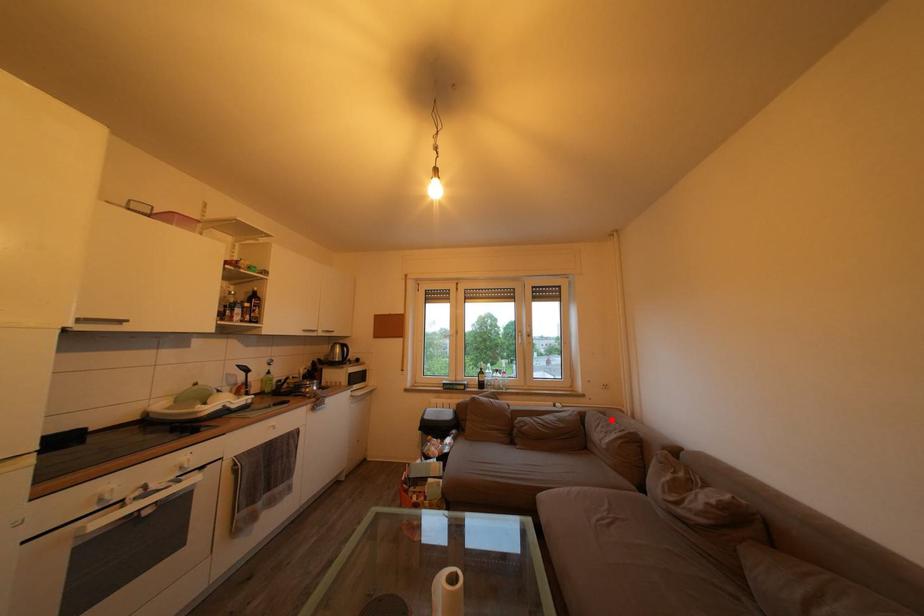
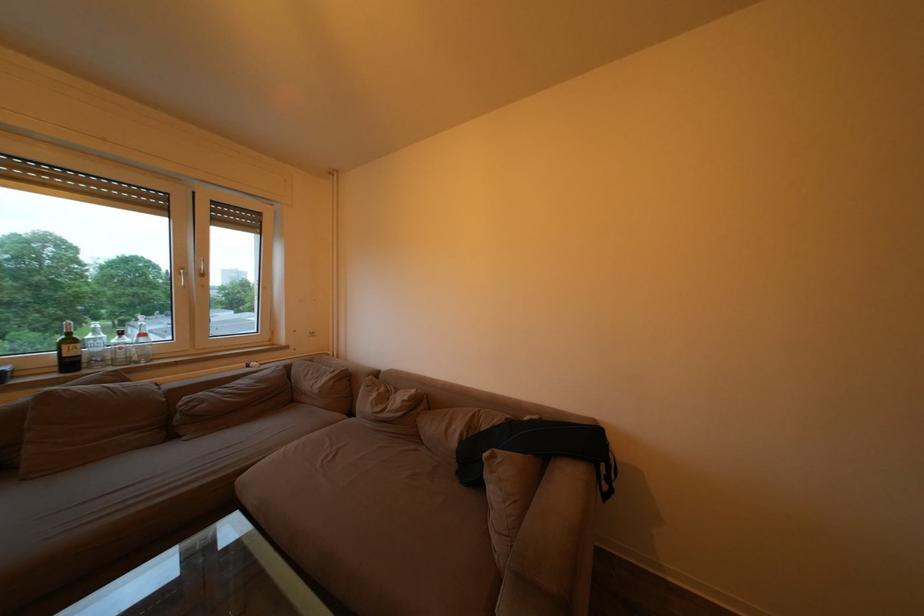
Where in the second image is the point corresponding to the highlighted location from the first image?

(319, 367)